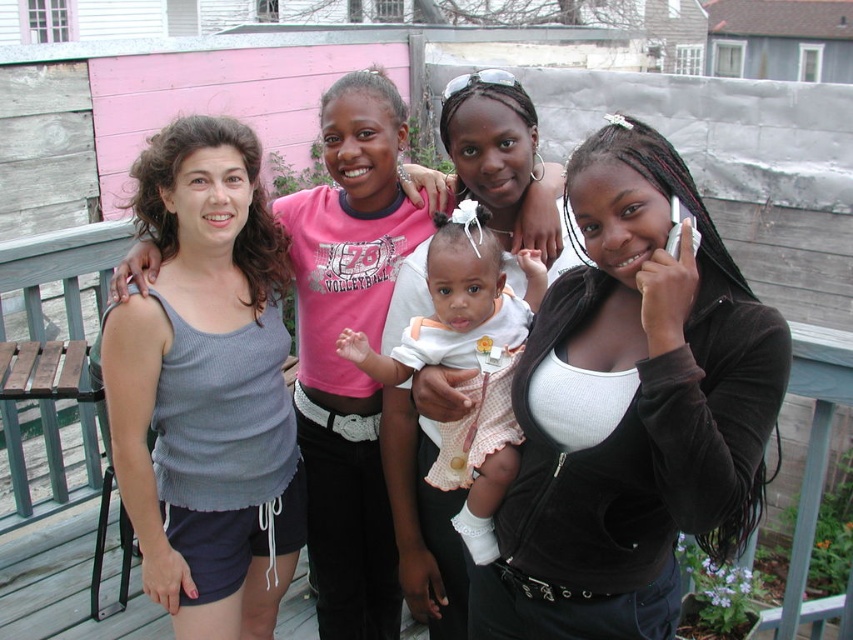
Question: Can you confirm if wooden deck at center is smaller than white polka dot dress at center?

Choices:
 (A) no
 (B) yes

Answer: (A)

Question: Can you confirm if black velvet jacket at upper right is thinner than white polka dot dress at center?

Choices:
 (A) no
 (B) yes

Answer: (A)

Question: Does black velvet jacket at upper right appear on the right side of gray ribbed tank top at center?

Choices:
 (A) yes
 (B) no

Answer: (A)

Question: Which point is farther to the camera?

Choices:
 (A) black velvet jacket at upper right
 (B) wooden deck at center

Answer: (B)

Question: Which object appears closest to the camera in this image?

Choices:
 (A) gray ribbed tank top at center
 (B) white polka dot dress at center
 (C) wooden deck at center
 (D) black velvet jacket at upper right

Answer: (D)

Question: Estimate the real-world distances between objects in this image. Which object is closer to the gray ribbed tank top at center?

Choices:
 (A) white polka dot dress at center
 (B) wooden deck at center
 (C) black velvet jacket at upper right

Answer: (A)